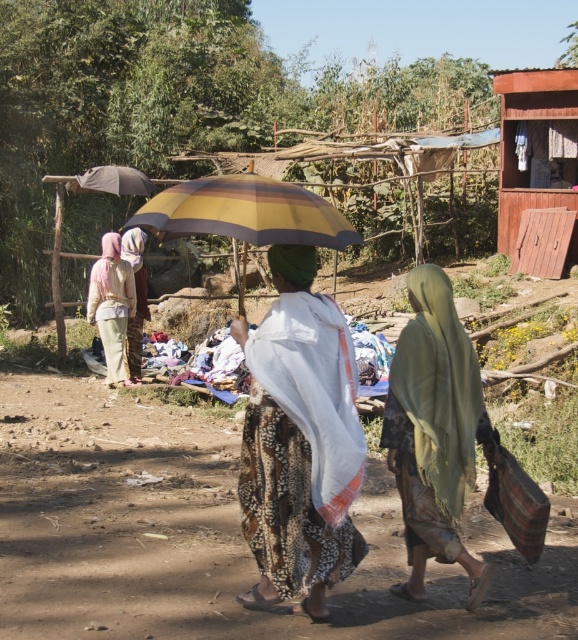
In the scene shown: Does patterned fabric dress at center have a larger size compared to green sheer scarf at center?

Yes.

Who is more distant from viewer, (324, 378) or (457, 376)?

The point (457, 376) is behind.

The width and height of the screenshot is (578, 640). I want to click on patterned fabric dress at center, so click(x=294, y=449).

Between point (413, 592) and point (114, 344), which one is positioned behind?

The point (114, 344) is more distant.

Who is more forward, (461,461) or (98,304)?

Point (461,461) is more forward.

Is point (420, 499) positioned in front of point (106, 336)?

Yes.

What are the coordinates of `green sheer scarf at center` in the screenshot? It's located at (434, 432).

Who is lower down, brown dirt field at center or light pink fabric at left?

brown dirt field at center is below.

Locate an element on the screen. This screenshot has width=578, height=640. brown dirt field at center is located at coordinates 213,532.